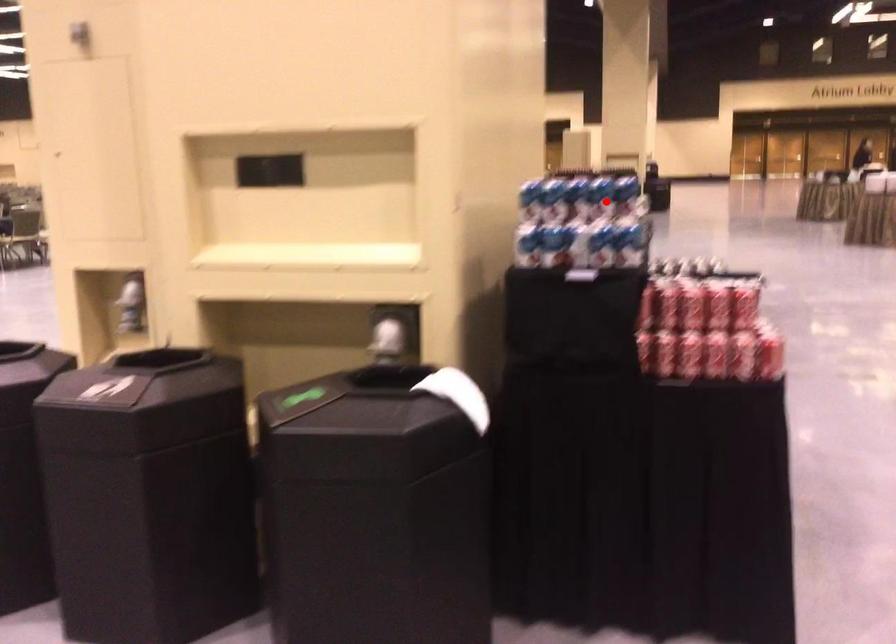
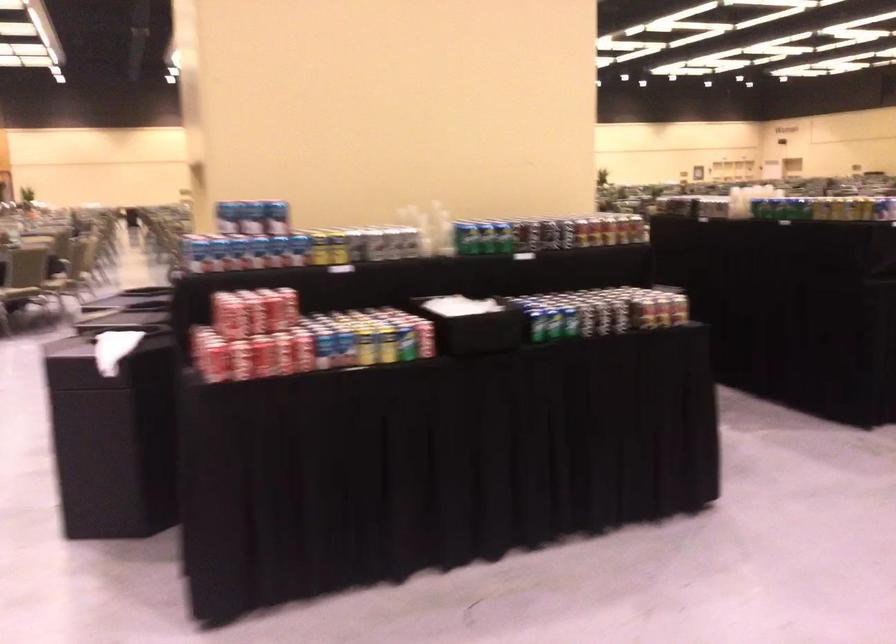
Find the pixel in the second image that matches the highlighted location in the first image.

(257, 216)